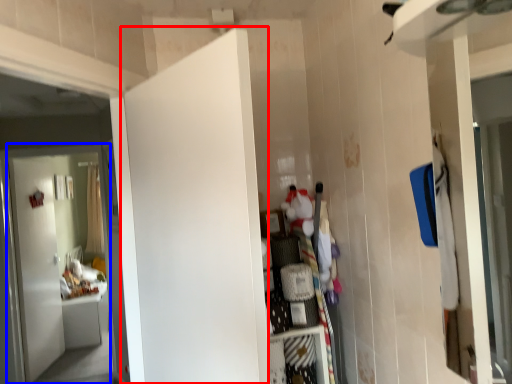
Question: Which object is closer to the camera taking this photo, door (highlighted by a red box) or door (highlighted by a blue box)?

Choices:
 (A) door
 (B) door

Answer: (A)